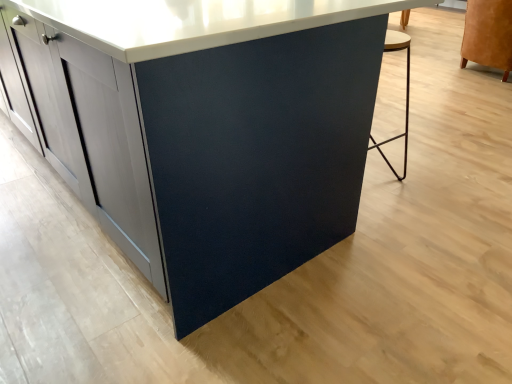
Where is `suede orange sofa at upper right`? suede orange sofa at upper right is located at coordinates (488, 34).

Describe the element at coordinates (488, 34) in the screenshot. This screenshot has width=512, height=384. I see `suede orange sofa at upper right` at that location.

You are a GUI agent. You are given a task and a screenshot of the screen. Output one action in this format:
    pyautogui.click(x=<x>, y=<y>)
    Task: Click on the suede orange sofa at upper right
    This screenshot has width=512, height=384.
    Given the screenshot: What is the action you would take?
    pyautogui.click(x=488, y=34)